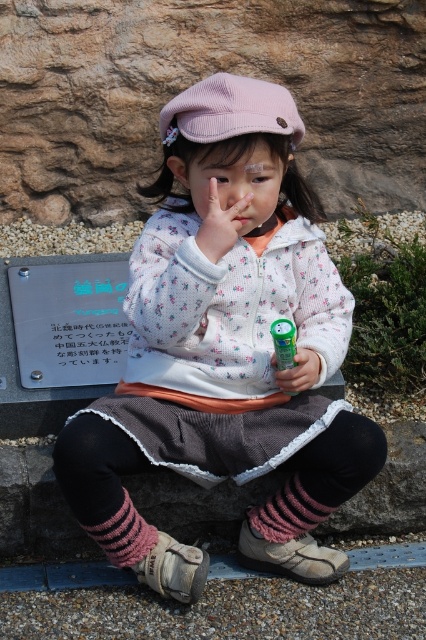
Does matte pink hand at center appear over green plastic can at center?

Yes.

Describe the element at coordinates (219, 225) in the screenshot. This screenshot has height=640, width=426. I see `matte pink hand at center` at that location.

The height and width of the screenshot is (640, 426). Find the location of `matte pink hand at center`. matte pink hand at center is located at coordinates (219, 225).

In the scene shown: Does fluffy pink beret at center appear over green plastic can at center?

No.

Can you confirm if fluffy pink beret at center is bigger than green plastic can at center?

Yes, fluffy pink beret at center is bigger than green plastic can at center.

What do you see at coordinates (224, 316) in the screenshot? I see `fluffy pink beret at center` at bounding box center [224, 316].

Identify the location of fluffy pink beret at center. This screenshot has height=640, width=426. (224, 316).

Is fluffy pink beret at center in front of pink knitted sock at lower left?

Result: Yes.

Who is more forward, (149, 438) or (155, 532)?

Point (149, 438) is more forward.

Where is `fluffy pink beret at center`? fluffy pink beret at center is located at coordinates (224, 316).